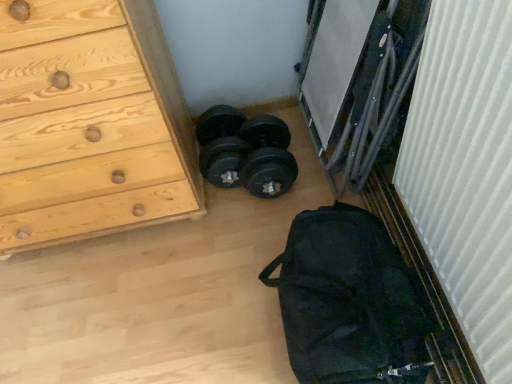
Locate an element on the screen. vacant area that is in front of natural wood chest of drawers at left is located at coordinates (119, 301).